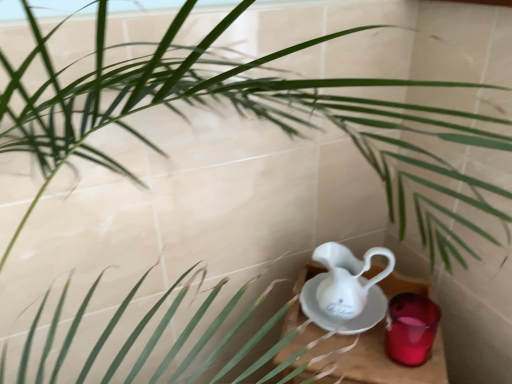
Question: From the image's perspective, does translucent glass candle at lower right appear lower than wooden table at lower right?

Choices:
 (A) yes
 (B) no

Answer: (B)

Question: Is translucent glass candle at lower right positioned beyond the bounds of wooden table at lower right?

Choices:
 (A) no
 (B) yes

Answer: (B)

Question: Is wooden table at lower right at the back of translucent glass candle at lower right?

Choices:
 (A) no
 (B) yes

Answer: (A)

Question: From a real-world perspective, is translucent glass candle at lower right on top of wooden table at lower right?

Choices:
 (A) no
 (B) yes

Answer: (B)

Question: Does translucent glass candle at lower right have a larger size compared to wooden table at lower right?

Choices:
 (A) no
 (B) yes

Answer: (A)

Question: Considering the relative sizes of translucent glass candle at lower right and wooden table at lower right in the image provided, is translucent glass candle at lower right wider than wooden table at lower right?

Choices:
 (A) no
 (B) yes

Answer: (A)

Question: Can you confirm if wooden table at lower right is shorter than translucent glass candle at lower right?

Choices:
 (A) yes
 (B) no

Answer: (B)

Question: From the image's perspective, is wooden table at lower right on translucent glass candle at lower right?

Choices:
 (A) no
 (B) yes

Answer: (A)

Question: Is wooden table at lower right facing towards translucent glass candle at lower right?

Choices:
 (A) yes
 (B) no

Answer: (B)

Question: Considering the relative sizes of wooden table at lower right and translucent glass candle at lower right in the image provided, is wooden table at lower right smaller than translucent glass candle at lower right?

Choices:
 (A) no
 (B) yes

Answer: (A)

Question: From a real-world perspective, is wooden table at lower right positioned over translucent glass candle at lower right based on gravity?

Choices:
 (A) no
 (B) yes

Answer: (A)

Question: Can you confirm if wooden table at lower right is taller than translucent glass candle at lower right?

Choices:
 (A) yes
 (B) no

Answer: (A)

Question: From a real-world perspective, is translucent glass candle at lower right located beneath white porcelain jug at lower right?

Choices:
 (A) yes
 (B) no

Answer: (A)